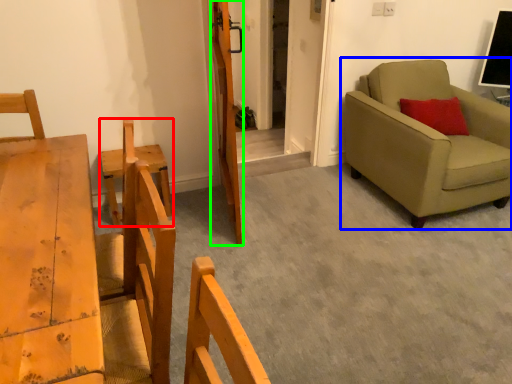
Question: Estimate the real-world distances between objects in this image. Which object is closer to armchair (highlighted by a red box), studio couch (highlighted by a blue box) or door (highlighted by a green box)?

Choices:
 (A) studio couch
 (B) door

Answer: (B)